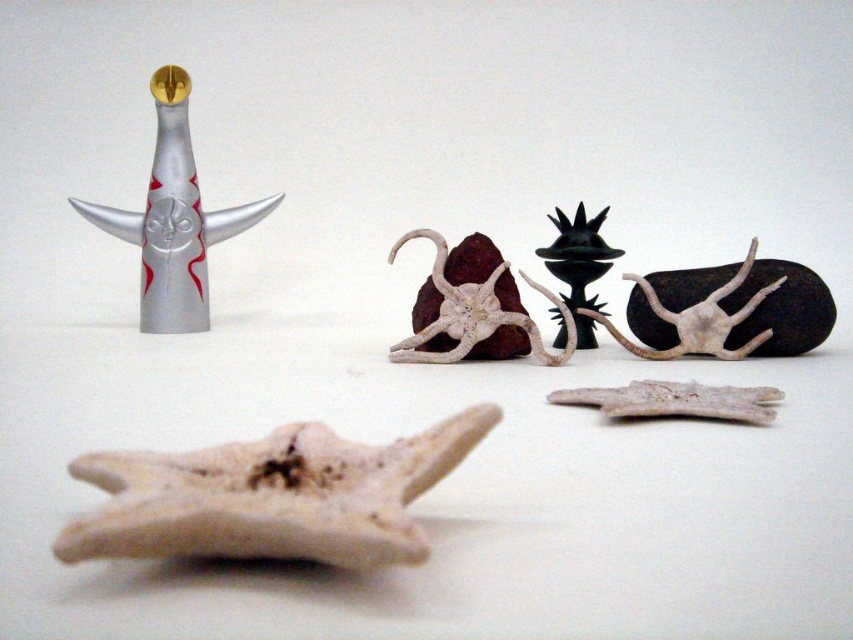
Which is behind, point (213, 456) or point (166, 220)?

Positioned behind is point (166, 220).

Describe the element at coordinates (271, 497) in the screenshot. I see `white matte bone at center` at that location.

Does point (363, 476) come farther from viewer compared to point (140, 310)?

No, (363, 476) is closer to viewer.

Where is `white matte bone at center`? Image resolution: width=853 pixels, height=640 pixels. white matte bone at center is located at coordinates (271, 497).

Who is more distant from viewer, (703, 275) or (577, 339)?

Point (577, 339)

Who is shorter, white matte starfish at center-right or black matte sculpture at center?

white matte starfish at center-right is shorter.

Locate an element on the screen. The image size is (853, 640). white matte starfish at center-right is located at coordinates (730, 310).

Is transparent glass figurine at upper left taller than black matte sculpture at center?

Yes, transparent glass figurine at upper left is taller than black matte sculpture at center.

Locate an element on the screen. The height and width of the screenshot is (640, 853). transparent glass figurine at upper left is located at coordinates (173, 218).

The image size is (853, 640). I want to click on transparent glass figurine at upper left, so click(x=173, y=218).